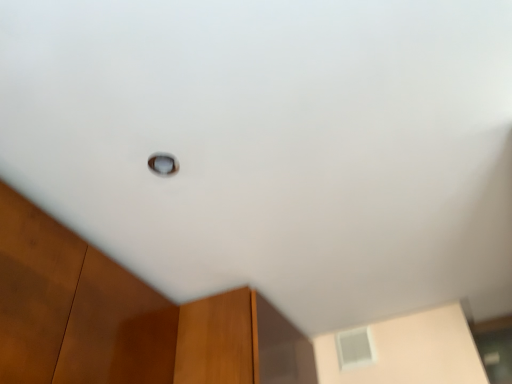
Question: Is white frosted glass window at upper center, acting as the first window starting from the right, situated inside transparent glass window at center, the second window when ordered from bottom to top, or outside?

Choices:
 (A) outside
 (B) inside

Answer: (A)

Question: In terms of width, does white frosted glass window at upper center, placed as the first window when sorted from bottom to top, look wider or thinner when compared to transparent glass window at center, arranged as the 1th window when viewed from the left?

Choices:
 (A) wide
 (B) thin

Answer: (A)

Question: From the image's perspective, is white frosted glass window at upper center, acting as the first window starting from the right, located above or below transparent glass window at center, acting as the 1th window starting from the front?

Choices:
 (A) above
 (B) below

Answer: (B)

Question: In terms of height, does transparent glass window at center, which ranks as the second window in right-to-left order, look taller or shorter compared to white frosted glass window at upper center, the first window in the back-to-front sequence?

Choices:
 (A) tall
 (B) short

Answer: (B)

Question: From the image's perspective, is transparent glass window at center, arranged as the 1th window when viewed from the left, positioned above or below white frosted glass window at upper center, placed as the first window when sorted from bottom to top?

Choices:
 (A) above
 (B) below

Answer: (A)

Question: In the image, is transparent glass window at center, which ranks as the second window in back-to-front order, on the left side or the right side of white frosted glass window at upper center, acting as the first window starting from the right?

Choices:
 (A) left
 (B) right

Answer: (A)

Question: Considering the positions of point (177, 165) and point (346, 334), is point (177, 165) closer or farther from the camera than point (346, 334)?

Choices:
 (A) closer
 (B) farther

Answer: (A)